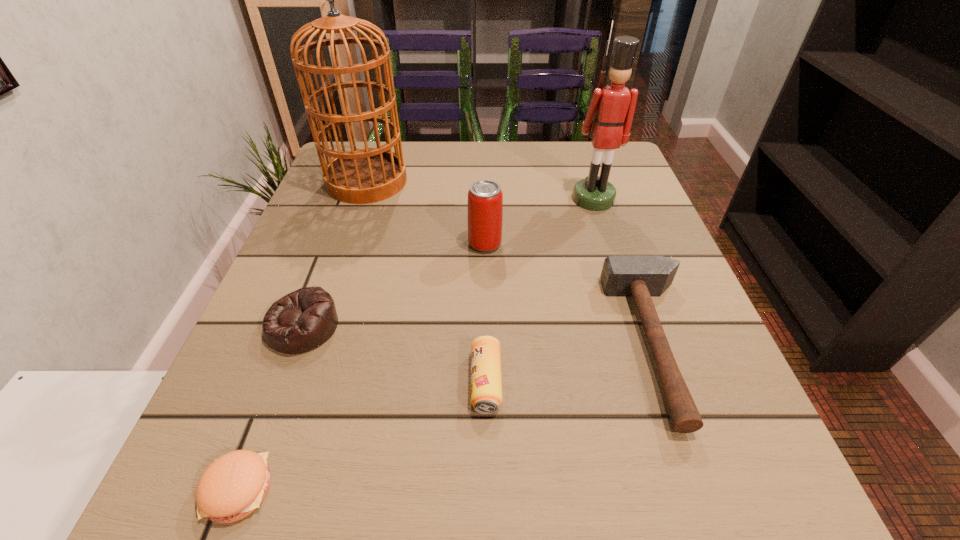
This screenshot has width=960, height=540. Find the location of `birdcage that is positioned at the left edge`. birdcage that is positioned at the left edge is located at coordinates (366, 175).

This screenshot has height=540, width=960. I want to click on beanbag that is at the left edge, so click(x=303, y=320).

Identify the location of patty at the left edge. Image resolution: width=960 pixels, height=540 pixels. click(x=234, y=485).

Where is `nutcracker positioned at the right edge`? Image resolution: width=960 pixels, height=540 pixels. nutcracker positioned at the right edge is located at coordinates (609, 117).

The height and width of the screenshot is (540, 960). I want to click on hammer at the right edge, so click(641, 277).

This screenshot has width=960, height=540. Identify the location of object that is positioned at the far left corner. (366, 175).

Image resolution: width=960 pixels, height=540 pixels. What are the coordinates of `object at the near left corner` in the screenshot? It's located at point(234,485).

Locate an element on the screen. object located in the far right corner section of the desktop is located at coordinates (609, 117).

Where is `free spot at the far edge of the desktop`? free spot at the far edge of the desktop is located at coordinates (542, 188).

In the image, there is a desktop. Where is `vacant space at the near edge`? vacant space at the near edge is located at coordinates (452, 516).